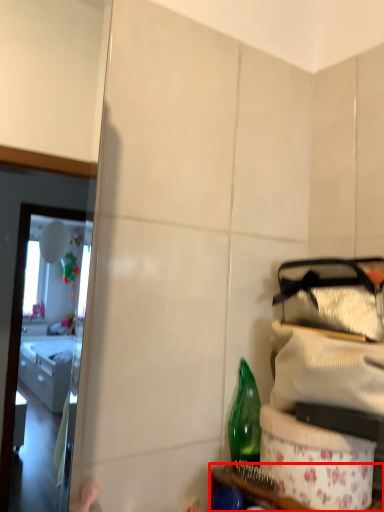
Question: Observing the image, what is the correct spatial positioning of furniture (annotated by the red box) in reference to bottle?

Choices:
 (A) left
 (B) right

Answer: (B)